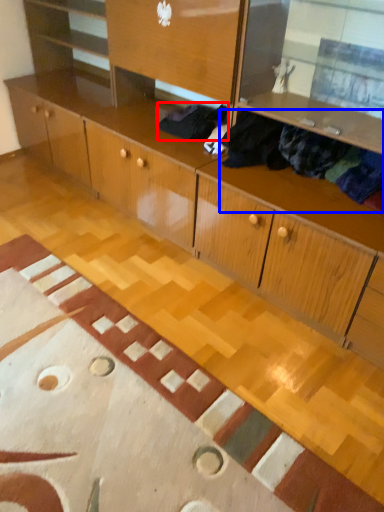
Question: Among these objects, which one is farthest to the camera, clothing (highlighted by a red box) or clothing (highlighted by a blue box)?

Choices:
 (A) clothing
 (B) clothing

Answer: (A)